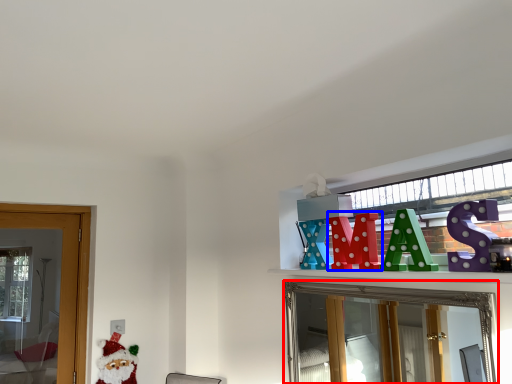
Question: Which of the following is the closest to the observer, mirror (highlighted by a red box) or toy (highlighted by a blue box)?

Choices:
 (A) mirror
 (B) toy

Answer: (A)